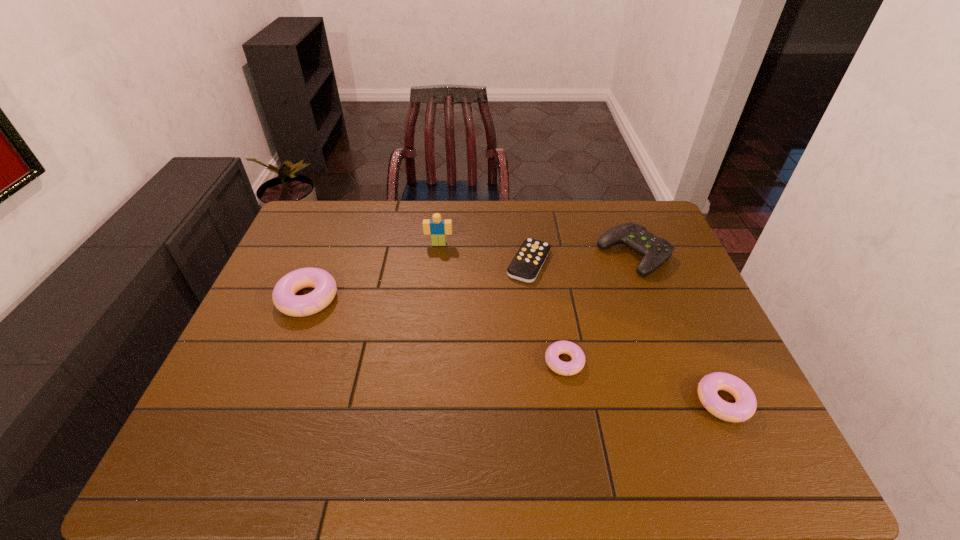
You are a GUI agent. You are given a task and a screenshot of the screen. Output one action in this format:
    pyautogui.click(x=<x>, y=<y>)
    Task: Click on the control at the right edge
    The height and width of the screenshot is (540, 960).
    Given the screenshot: What is the action you would take?
    pyautogui.click(x=655, y=250)

Where is `object situated at the far right corner`? This screenshot has width=960, height=540. object situated at the far right corner is located at coordinates (655, 250).

The image size is (960, 540). I want to click on object at the near right corner, so click(x=745, y=406).

Locate an element on the screen. The image size is (960, 540). vacant space at the far edge of the desktop is located at coordinates (473, 241).

You are a GUI agent. You are given a task and a screenshot of the screen. Output one action in this format:
    pyautogui.click(x=<x>, y=<y>)
    Task: Click on the blank area at the near edge
    
    Given the screenshot: What is the action you would take?
    (429, 407)

The width and height of the screenshot is (960, 540). What are the coordinates of `vacant space at the left edge of the desktop` in the screenshot? It's located at (324, 250).

Find the location of `vacant space at the right edge of the desktop`. vacant space at the right edge of the desktop is located at coordinates (702, 326).

Where is `vacant area that lies between the farthest doughnut and the shortest doughnut`? vacant area that lies between the farthest doughnut and the shortest doughnut is located at coordinates (436, 330).

Where is `empty space between the remote control and the fifth object from right to left`? empty space between the remote control and the fifth object from right to left is located at coordinates (484, 253).

Find the location of `vacant region between the shortest doughnut and the control`. vacant region between the shortest doughnut and the control is located at coordinates (599, 308).